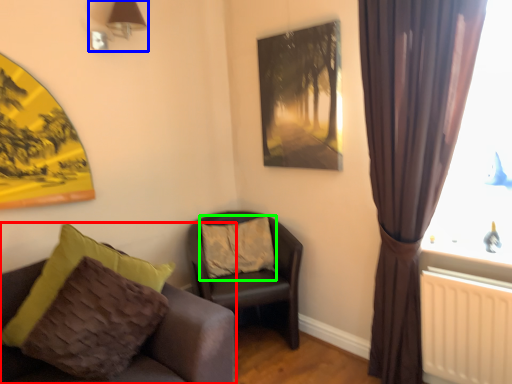
Question: Which object is the closest to the chair (highlighted by a red box)? Choose among these: lamp (highlighted by a blue box) or pillow (highlighted by a green box).

Choices:
 (A) lamp
 (B) pillow

Answer: (B)